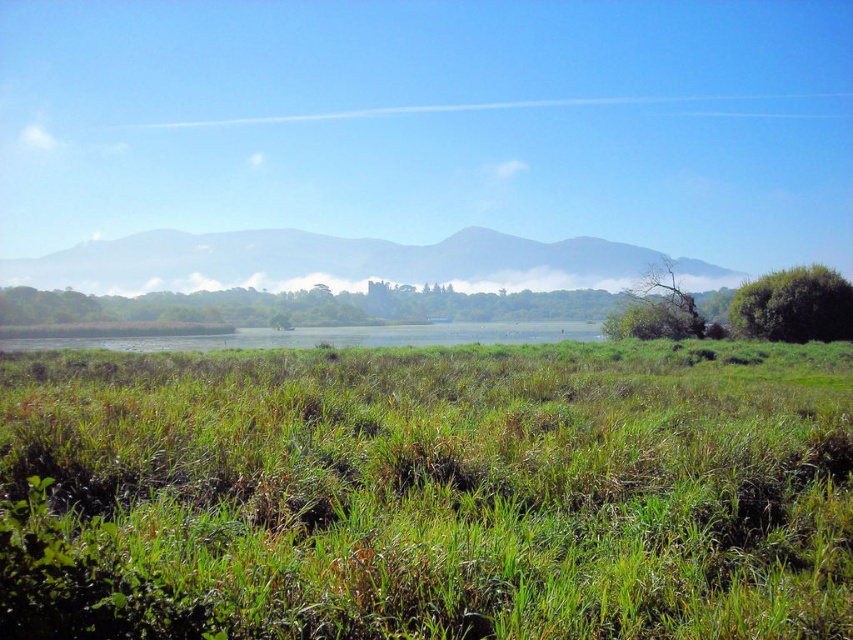
Is green grassy hill at center above green leafy bush at right?

Correct, green grassy hill at center is located above green leafy bush at right.

The height and width of the screenshot is (640, 853). What do you see at coordinates (328, 262) in the screenshot?
I see `green grassy hill at center` at bounding box center [328, 262].

This screenshot has height=640, width=853. In order to click on green grassy hill at center in this screenshot , I will do click(x=328, y=262).

Between point (225, 449) and point (811, 276), which one is positioned in front?

Point (225, 449) is more forward.

Is green grassy field at center taller than green leafy bush at right?

No, green grassy field at center is not taller than green leafy bush at right.

Between point (534, 435) and point (778, 276), which one is positioned behind?

The point (778, 276) is more distant.

Where is `green grassy field at center`? This screenshot has height=640, width=853. green grassy field at center is located at coordinates (428, 492).

Between green grassy hill at center and green leafy tree at right, which one appears on the left side from the viewer's perspective?

green grassy hill at center is more to the left.

Which is behind, point (448, 243) or point (619, 330)?

Point (448, 243)

The width and height of the screenshot is (853, 640). I want to click on green grassy hill at center, so click(x=328, y=262).

At what (x,y) coordinates should I click in order to perform the action: click on green grassy hill at center. Please return your answer as a coordinate pair (x, y). Looking at the image, I should click on (328, 262).